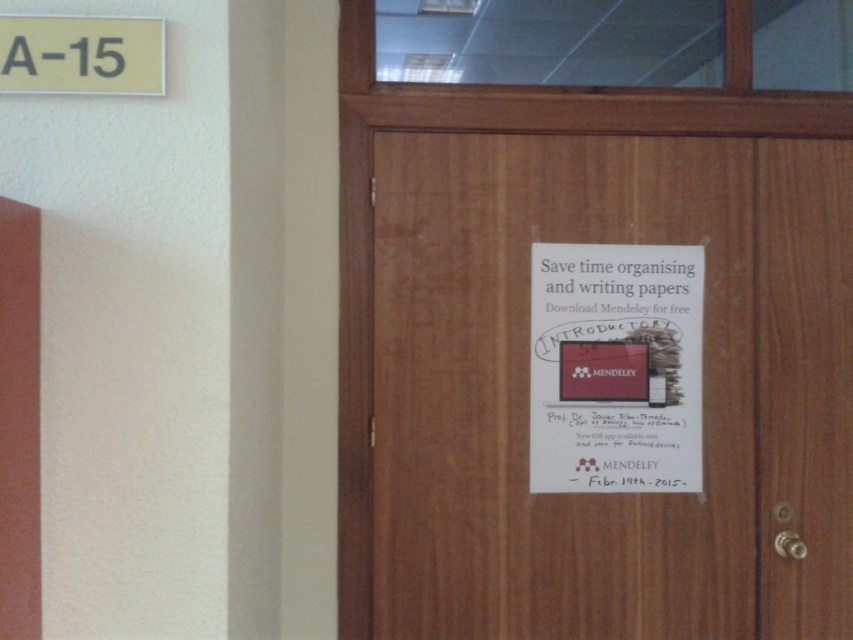
Is smooth wood door at left to the left of yellow plastic sign at upper left from the viewer's perspective?

Correct, you'll find smooth wood door at left to the left of yellow plastic sign at upper left.

Identify the location of smooth wood door at left. The width and height of the screenshot is (853, 640). (19, 420).

Locate an element on the screen. The width and height of the screenshot is (853, 640). smooth wood door at left is located at coordinates (19, 420).

Who is positioned more to the left, wooden door at center or smooth wood door at left?

Positioned to the left is smooth wood door at left.

Is the position of wooden door at center more distant than that of smooth wood door at left?

Yes, wooden door at center is further from the viewer.

Measure the distance between point (x=525, y=392) and camera.

Point (x=525, y=392) and camera are 2.45 meters apart from each other.

Locate an element on the screen. wooden door at center is located at coordinates (595, 364).

Does wooden door at center have a larger size compared to yellow plastic sign at upper left?

Correct, wooden door at center is larger in size than yellow plastic sign at upper left.

Can you confirm if wooden door at center is positioned above yellow plastic sign at upper left?

Actually, wooden door at center is below yellow plastic sign at upper left.

Does point (663, 200) come closer to viewer compared to point (38, 26)?

No, (663, 200) is behind (38, 26).

The image size is (853, 640). Identify the location of wooden door at center. (595, 364).